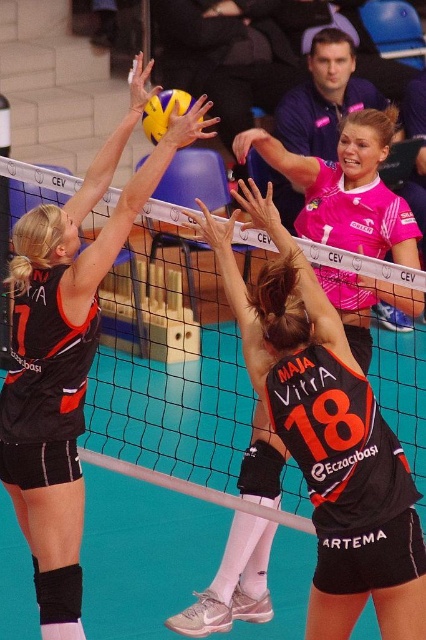
Does pink jersey at upper center have a smaller size compared to yellow matte volleyball at upper center?

Incorrect, pink jersey at upper center is not smaller in size than yellow matte volleyball at upper center.

Can you confirm if pink jersey at upper center is thinner than yellow matte volleyball at upper center?

Incorrect, pink jersey at upper center's width is not less than yellow matte volleyball at upper center's.

Is point (357, 170) in front of point (146, 122)?

Yes.

Find the location of a particular element. The image size is (426, 640). pink jersey at upper center is located at coordinates (345, 188).

Can you confirm if black matte jersey at left is positioned below yellow matte volleyball at upper center?

Yes, black matte jersey at left is below yellow matte volleyball at upper center.

Between point (49, 572) and point (158, 116), which one is positioned in front?

Point (49, 572) is in front.

You are a GUI agent. You are given a task and a screenshot of the screen. Output one action in this format:
    pyautogui.click(x=<x>, y=<y>)
    Task: Click on the black matte jersey at left
    This screenshot has height=640, width=426.
    Given the screenshot: What is the action you would take?
    pyautogui.click(x=66, y=355)

Describe the element at coordinates (66, 355) in the screenshot. The height and width of the screenshot is (640, 426). I see `black matte jersey at left` at that location.

Who is positioned more to the right, black matte jersey at left or pink jersey at upper center?

From the viewer's perspective, pink jersey at upper center appears more on the right side.

Locate an element on the screen. black matte jersey at left is located at coordinates (66, 355).